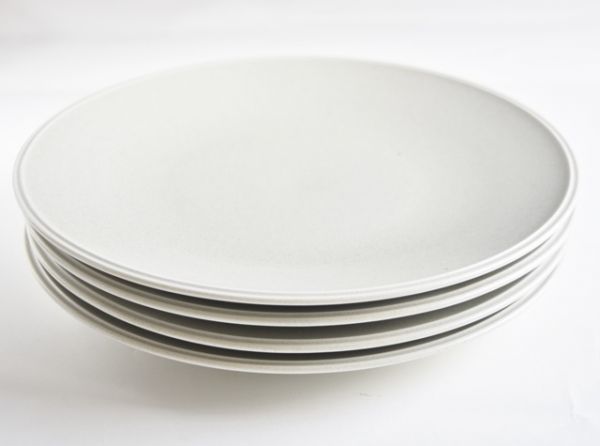
I want to click on plates, so click(x=264, y=365), click(x=276, y=352), click(x=278, y=325), click(x=292, y=303).